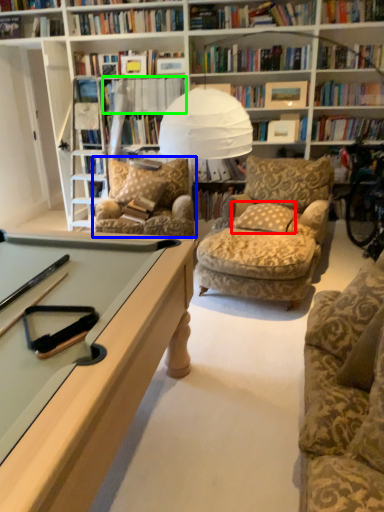
Question: Which object is the farthest from pillow (highlighted by a red box)? Choose among these: chair (highlighted by a blue box) or book (highlighted by a green box).

Choices:
 (A) chair
 (B) book

Answer: (B)